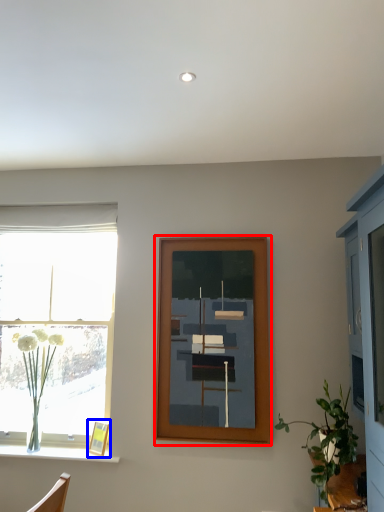
Question: Which point is further to the camera, picture frame (highlighted by a red box) or picture frame (highlighted by a blue box)?

Choices:
 (A) picture frame
 (B) picture frame

Answer: (B)